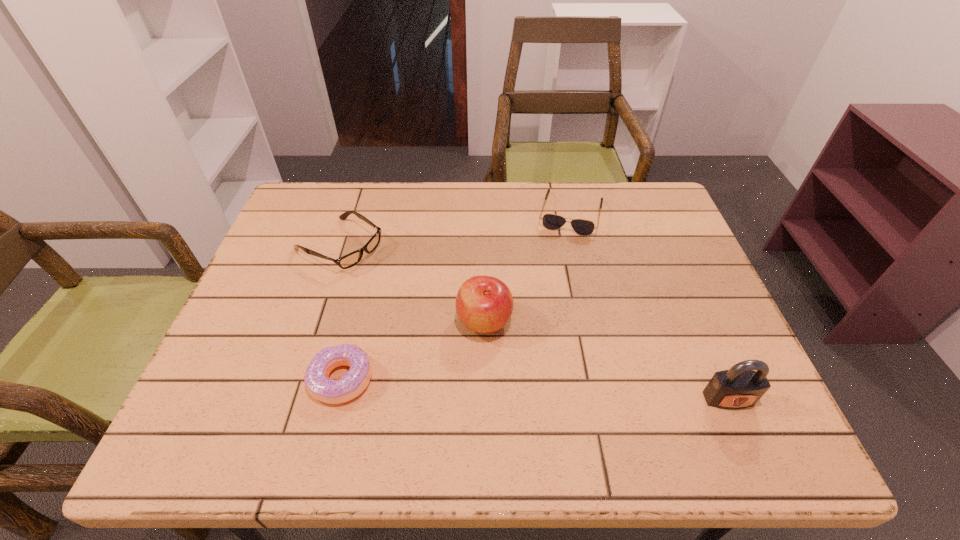
Find the location of a particular element. free spot located on the front-facing side of the second object from right to left is located at coordinates (555, 284).

At what (x,y) coordinates should I click in order to perform the action: click on free space located 0.260m on the front-facing side of the second object from right to left. Please return your answer as a coordinate pair (x, y). The height and width of the screenshot is (540, 960). Looking at the image, I should click on (550, 304).

Image resolution: width=960 pixels, height=540 pixels. Find the location of `free space located on the front-facing side of the second object from right to left`. free space located on the front-facing side of the second object from right to left is located at coordinates (548, 313).

Where is `free location located 0.310m on the front-facing side of the spectacles`? The image size is (960, 540). free location located 0.310m on the front-facing side of the spectacles is located at coordinates (464, 319).

Image resolution: width=960 pixels, height=540 pixels. I want to click on vacant area situated on the front-facing side of the spectacles, so click(481, 329).

Find the location of a particular element. Image resolution: width=960 pixels, height=540 pixels. vacant area situated on the front-facing side of the spectacles is located at coordinates (431, 299).

At what (x,y) coordinates should I click in order to perform the action: click on sunglasses present at the far edge. Please return your answer as a coordinate pair (x, y). Looking at the image, I should click on (x=582, y=227).

The height and width of the screenshot is (540, 960). Find the location of `spectacles located at the far edge`. spectacles located at the far edge is located at coordinates (351, 259).

At what (x,y) coordinates should I click in order to perform the action: click on doughnut positioned at the near edge. Please return your answer as a coordinate pair (x, y). The image size is (960, 540). Looking at the image, I should click on (354, 382).

This screenshot has height=540, width=960. I want to click on padlock that is at the near edge, so click(740, 387).